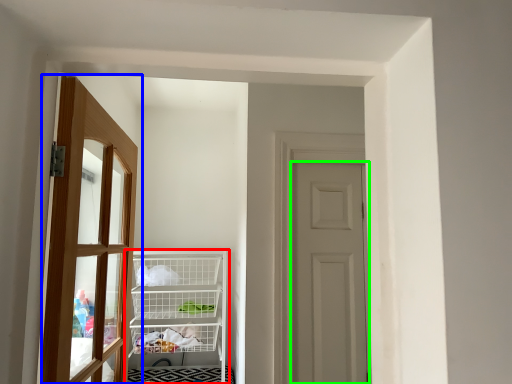
Question: Based on their relative distances, which object is nearer to shelf (highlighted by a red box)? Choose from door (highlighted by a blue box) and door (highlighted by a green box).

Choices:
 (A) door
 (B) door

Answer: (A)